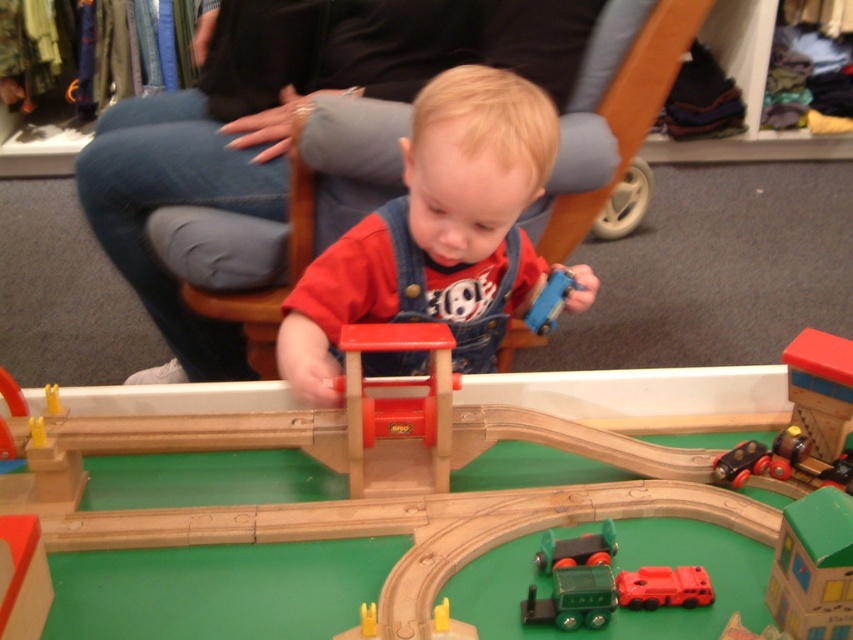
You are a parent observing your child playing with the wooden toy train set. You notice the wooden bridge at center and the blue plastic car at center. Which object is positioned lower in the image?

The wooden bridge at center is positioned below the blue plastic car at center, so it is lower in the image.

You are a toy organizer who needs to store the denim overalls at center and the metallic black train at lower right in a box. If the box can only fit one of them, which item should you choose based on their size?

The denim overalls at center has a larger size compared to the metallic black train at lower right, so you should choose to store the denim overalls at center in the box since it requires more space.

You are a toy designer observing the play area. You need to place a new toy helicopter exactly at the point marked by the coordinates point (376, 483). According to the scene description, where will the helicopter be placed?

The point (376, 483) corresponds to the wooden bridge at center, so placing the helicopter there would position it on the wooden bridge at center.